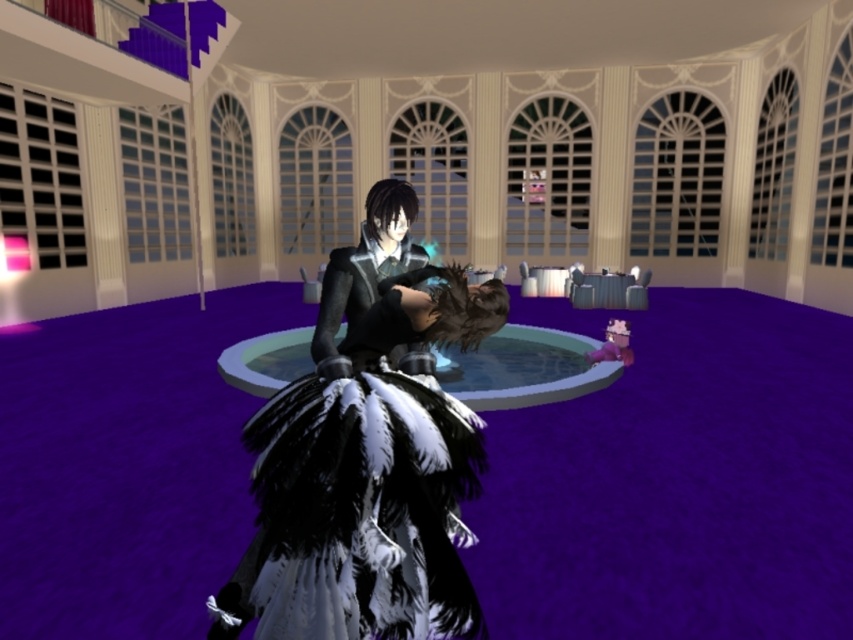
Is feathered black dress at center smaller than shiny black dress at center?

No.

Does feathered black dress at center have a lesser height compared to shiny black dress at center?

In fact, feathered black dress at center may be taller than shiny black dress at center.

Is point (405, 561) behind point (229, 353)?

No, (405, 561) is in front of (229, 353).

The image size is (853, 640). Find the location of `feathered black dress at center`. feathered black dress at center is located at coordinates (368, 483).

Is point (364, 477) behind point (408, 225)?

That is False.

Which is behind, point (404, 416) or point (323, 280)?

Positioned behind is point (323, 280).

I want to click on feathered black dress at center, so click(x=368, y=483).

In the scene shown: Measure the distance from shiny black dress at center to shiny black armor at center.

shiny black dress at center is 11.89 feet away from shiny black armor at center.

Is shiny black dress at center bigger than shiny black armor at center?

Yes.

Describe the element at coordinates (525, 369) in the screenshot. I see `shiny black dress at center` at that location.

This screenshot has width=853, height=640. Identify the location of shiny black dress at center. (525, 369).